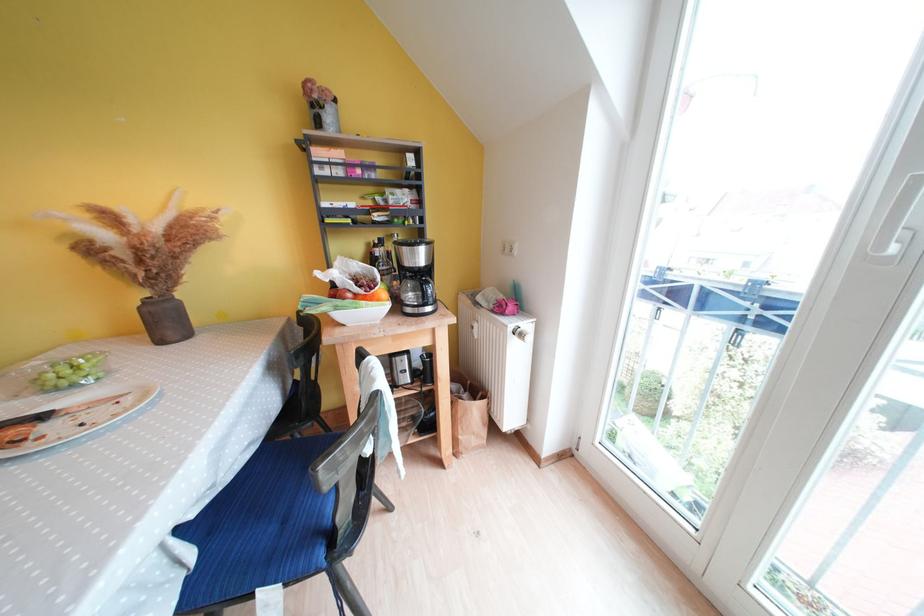
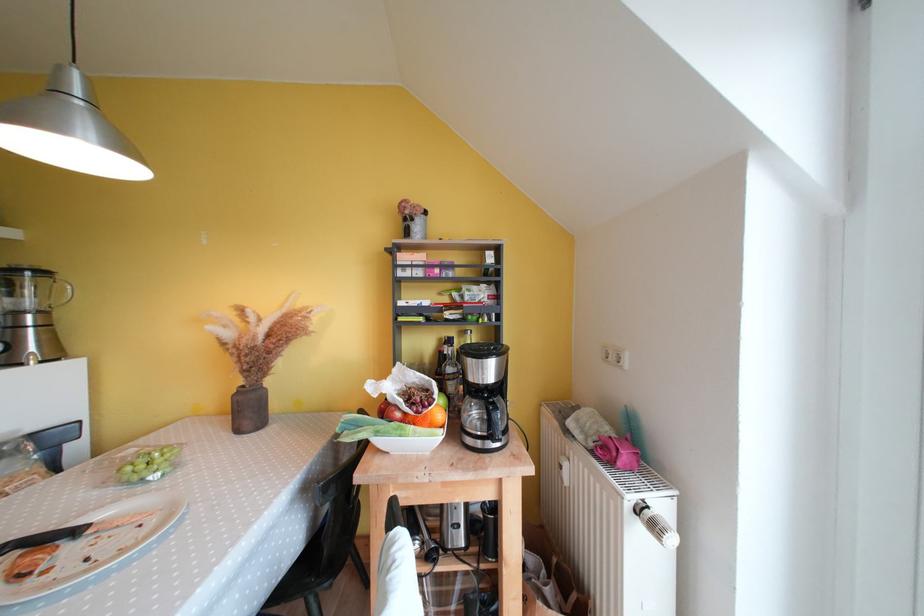
In the second image, find the point that corresponds to point (174, 329) in the first image.

(256, 416)